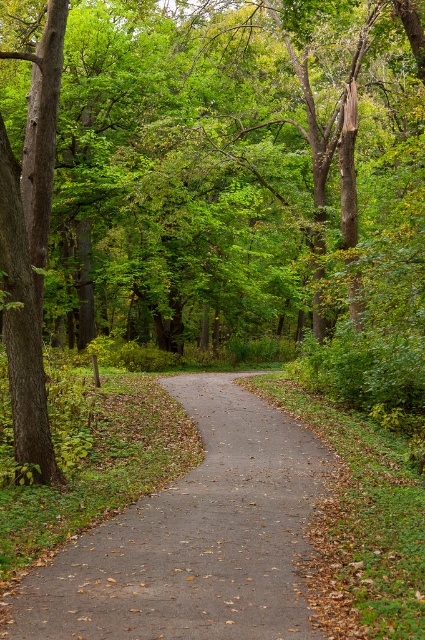
Between dull gray asphalt at center and brown rough bark tree at left, which one is positioned lower?

Positioned lower is dull gray asphalt at center.

Is point (231, 477) more distant than point (13, 232)?

Yes, it is.

Who is more forward, (47, 605) or (53, 20)?

Positioned in front is point (47, 605).

At what (x,y) coordinates should I click in order to perform the action: click on dull gray asphalt at center. Please return your answer as a coordinate pair (x, y). Image resolution: width=425 pixels, height=640 pixels. Looking at the image, I should click on (195, 538).